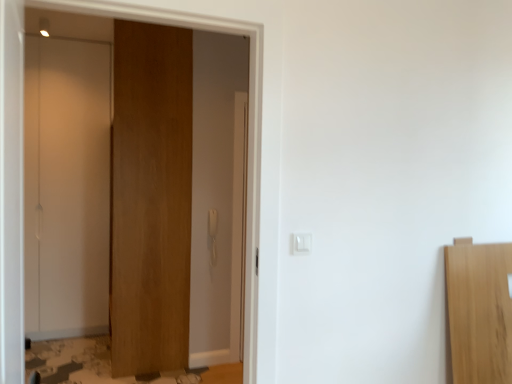
Question: From a real-world perspective, is white glossy door at left, which ranks as the first door in left-to-right order, located beneath white plastic light switch at center?

Choices:
 (A) no
 (B) yes

Answer: (A)

Question: From the image's perspective, is white glossy door at left, the second door viewed from the right, located beneath white plastic light switch at center?

Choices:
 (A) yes
 (B) no

Answer: (B)

Question: From the image's perspective, would you say white glossy door at left, the second door viewed from the right, is positioned over white plastic light switch at center?

Choices:
 (A) yes
 (B) no

Answer: (A)

Question: Does white glossy door at left, which ranks as the first door in left-to-right order, appear on the left side of white plastic light switch at center?

Choices:
 (A) yes
 (B) no

Answer: (A)

Question: Does white glossy door at left, which ranks as the first door in left-to-right order, have a greater width compared to white plastic light switch at center?

Choices:
 (A) yes
 (B) no

Answer: (A)

Question: Considering their positions, is white glossy door at left, the second door viewed from the right, located in front of or behind wooden door at center, arranged as the first door when viewed from the right?

Choices:
 (A) front
 (B) behind

Answer: (B)

Question: Which is correct: white glossy door at left, the second door viewed from the right, is inside wooden door at center, arranged as the first door when viewed from the right, or outside of it?

Choices:
 (A) outside
 (B) inside

Answer: (A)

Question: From a real-world perspective, is white glossy door at left, which ranks as the first door in left-to-right order, physically located above or below wooden door at center, arranged as the first door when viewed from the right?

Choices:
 (A) above
 (B) below

Answer: (B)

Question: Considering the positions of white glossy door at left, which ranks as the first door in left-to-right order, and wooden door at center, arranged as the first door when viewed from the right, in the image, is white glossy door at left, which ranks as the first door in left-to-right order, bigger or smaller than wooden door at center, arranged as the first door when viewed from the right,?

Choices:
 (A) small
 (B) big

Answer: (A)

Question: In terms of height, does wooden door at center, arranged as the first door when viewed from the right, look taller or shorter compared to white glossy door at left, which ranks as the first door in left-to-right order?

Choices:
 (A) tall
 (B) short

Answer: (A)

Question: Visually, is wooden door at center, arranged as the first door when viewed from the right, positioned to the left or to the right of white glossy door at left, which ranks as the first door in left-to-right order?

Choices:
 (A) right
 (B) left

Answer: (A)

Question: Is wooden door at center, arranged as the first door when viewed from the right, inside the boundaries of white glossy door at left, which ranks as the first door in left-to-right order, or outside?

Choices:
 (A) inside
 (B) outside

Answer: (B)

Question: In the image, is wooden door at center, the second door from the left, positioned in front of or behind white glossy door at left, which ranks as the first door in left-to-right order?

Choices:
 (A) front
 (B) behind

Answer: (A)

Question: From the image's perspective, relative to white plastic light switch at center, is white glossy door at left, the second door viewed from the right, above or below?

Choices:
 (A) below
 (B) above

Answer: (B)

Question: Is white glossy door at left, the second door viewed from the right, taller or shorter than white plastic light switch at center?

Choices:
 (A) short
 (B) tall

Answer: (B)